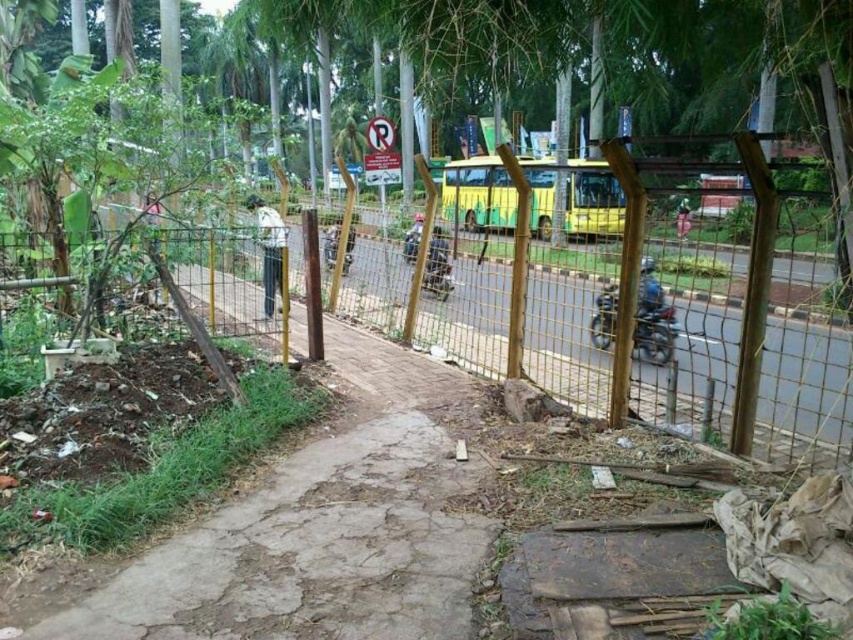
Question: Is brown rough dirt track at lower left smaller than blue metallic helmet at center?

Choices:
 (A) no
 (B) yes

Answer: (A)

Question: Considering the relative positions of blue metallic helmet at center and dark blue jeans at center in the image provided, where is blue metallic helmet at center located with respect to dark blue jeans at center?

Choices:
 (A) above
 (B) below

Answer: (B)

Question: Which object appears closest to the camera in this image?

Choices:
 (A) blue metallic helmet at center
 (B) smooth black helmet at center
 (C) brown rough dirt track at lower left
 (D) dark blue jeans at center

Answer: (C)

Question: Estimate the real-world distances between objects in this image. Which object is closer to the blue metallic helmet at center?

Choices:
 (A) metallic silver motorcycle at center
 (B) brown rough dirt track at lower left
 (C) white fabric shirt at center

Answer: (B)

Question: Among these objects, which one is nearest to the camera?

Choices:
 (A) dark blue jeans at center
 (B) metallic blue motorcycle at right

Answer: (B)

Question: Can you confirm if metallic blue motorcycle at right is thinner than metallic silver motorcycle at center?

Choices:
 (A) yes
 (B) no

Answer: (B)